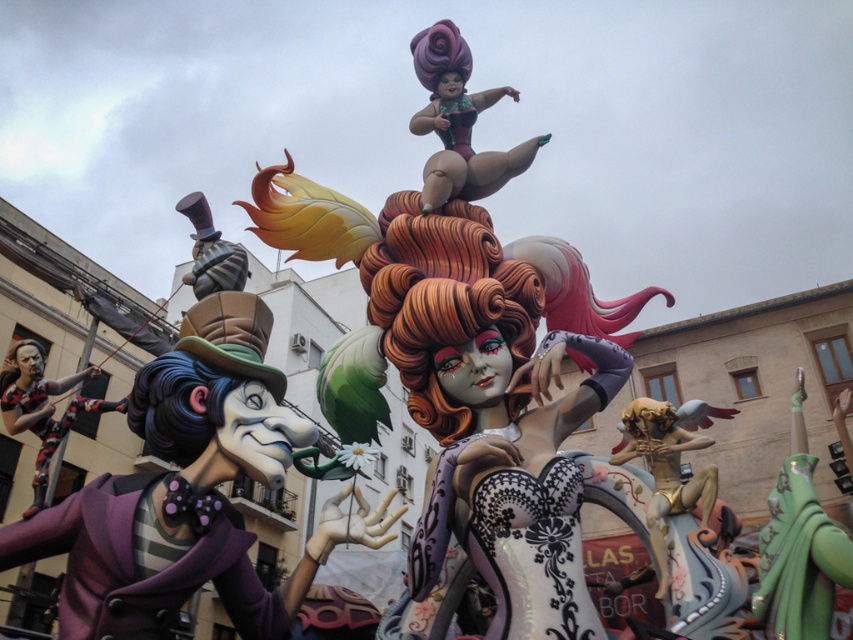
Does purple matte doll at upper center have a smaller size compared to black matte figure at left?

Indeed, purple matte doll at upper center has a smaller size compared to black matte figure at left.

Who is shorter, purple matte doll at upper center or black matte figure at left?

black matte figure at left is shorter.

Which is in front, point (486, 157) or point (33, 500)?

Positioned in front is point (33, 500).

In order to click on purple matte doll at upper center in this screenshot , I will do `click(457, 122)`.

Does matte purple suit at left lie behind purple matte doll at upper center?

No, matte purple suit at left is in front of purple matte doll at upper center.

Is matte purple suit at left to the right of purple matte doll at upper center from the viewer's perspective?

No, matte purple suit at left is not to the right of purple matte doll at upper center.

You are a GUI agent. You are given a task and a screenshot of the screen. Output one action in this format:
    pyautogui.click(x=<x>, y=<y>)
    Task: Click on the matte purple suit at left
    This screenshot has height=640, width=853.
    Given the screenshot: What is the action you would take?
    pyautogui.click(x=190, y=492)

Does point (442, 132) come farther from viewer compared to point (212, 278)?

Yes, point (442, 132) is behind point (212, 278).

Is point (430, 205) in front of point (231, 257)?

No.

Image resolution: width=853 pixels, height=640 pixels. Identify the location of purple matte doll at upper center. (457, 122).